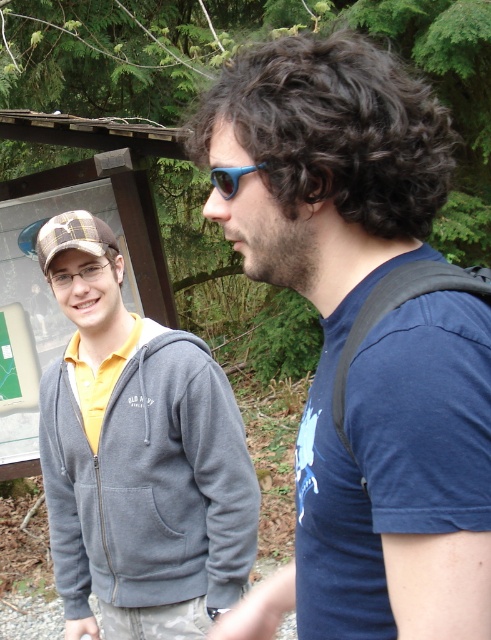
Question: Which point is closer to the camera taking this photo?

Choices:
 (A) (380, 268)
 (B) (128, 545)
 (C) (42, 236)

Answer: (A)

Question: Does blue matte t-shirt at center come behind plaid fabric baseball cap at left?

Choices:
 (A) yes
 (B) no

Answer: (B)

Question: Where is blue matte t-shirt at center located in relation to matte gray hoodie at left in the image?

Choices:
 (A) above
 (B) below

Answer: (A)

Question: Which point is farther from the camera taking this photo?

Choices:
 (A) (222, 179)
 (B) (97, 253)
 (C) (317, 625)

Answer: (B)

Question: Which object appears farthest from the camera in this image?

Choices:
 (A) blue matte t-shirt at center
 (B) matte gray hoodie at left
 (C) blue rubber sunglasses at center
 (D) plaid fabric baseball cap at left

Answer: (B)

Question: In this image, where is blue matte t-shirt at center located relative to matte gray hoodie at left?

Choices:
 (A) right
 (B) left

Answer: (A)